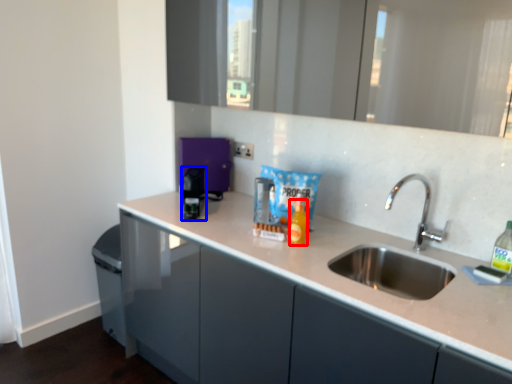
Question: Which point is further to the camera, bottle (highlighted by a red box) or appliance (highlighted by a blue box)?

Choices:
 (A) bottle
 (B) appliance

Answer: (B)